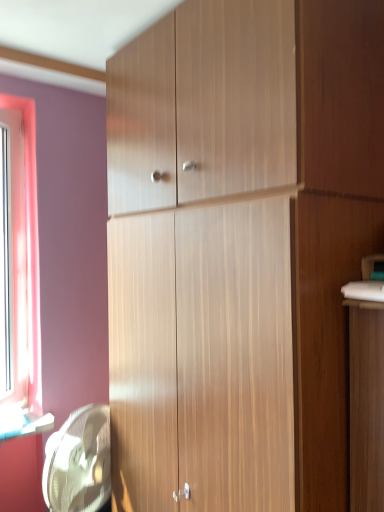
This screenshot has width=384, height=512. Identify the location of wooden cabinet at center. (239, 249).

What do you see at coordinates (239, 249) in the screenshot? I see `wooden cabinet at center` at bounding box center [239, 249].

This screenshot has width=384, height=512. What are the coordinates of `wooden cabinet at center` in the screenshot? It's located at coord(239,249).